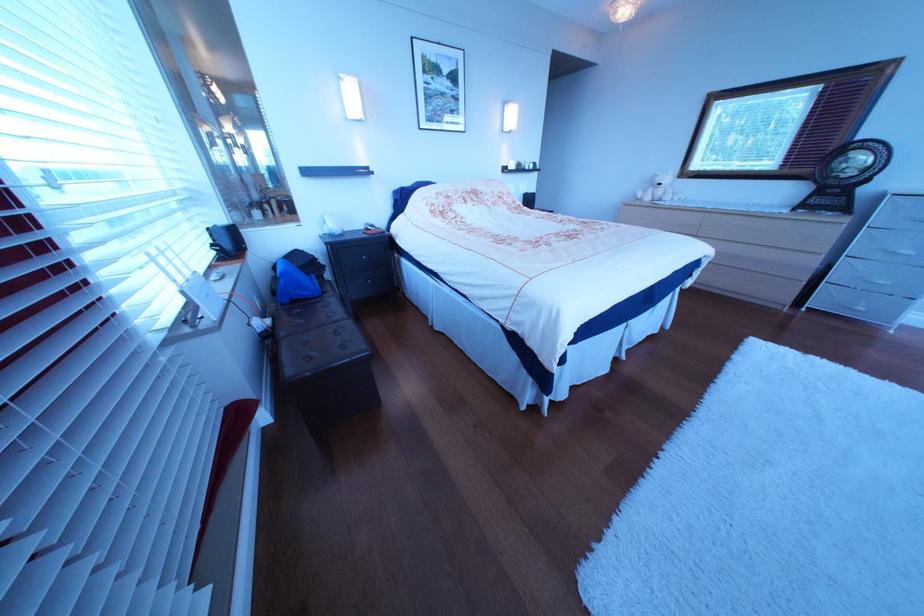
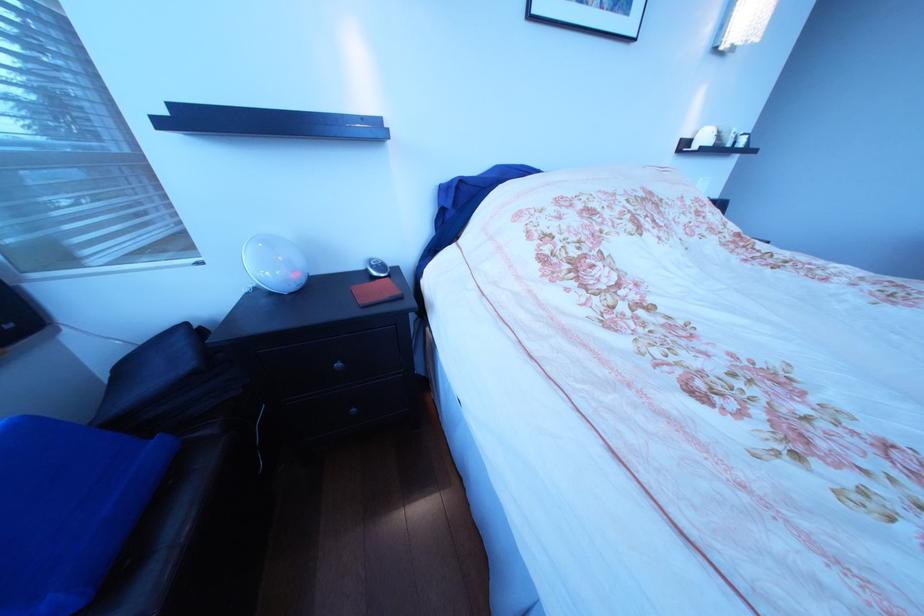
The point at (383,228) is marked in the first image. Where is the corresponding point in the second image?

(387, 268)